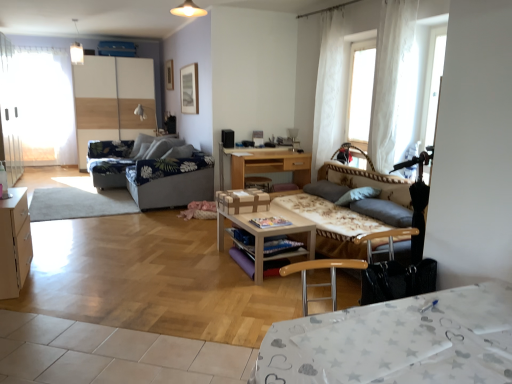
Find the location of a particular element. The image size is (512, 384). vacant area located to the right-hand side of light wood cabinet at left is located at coordinates (66, 282).